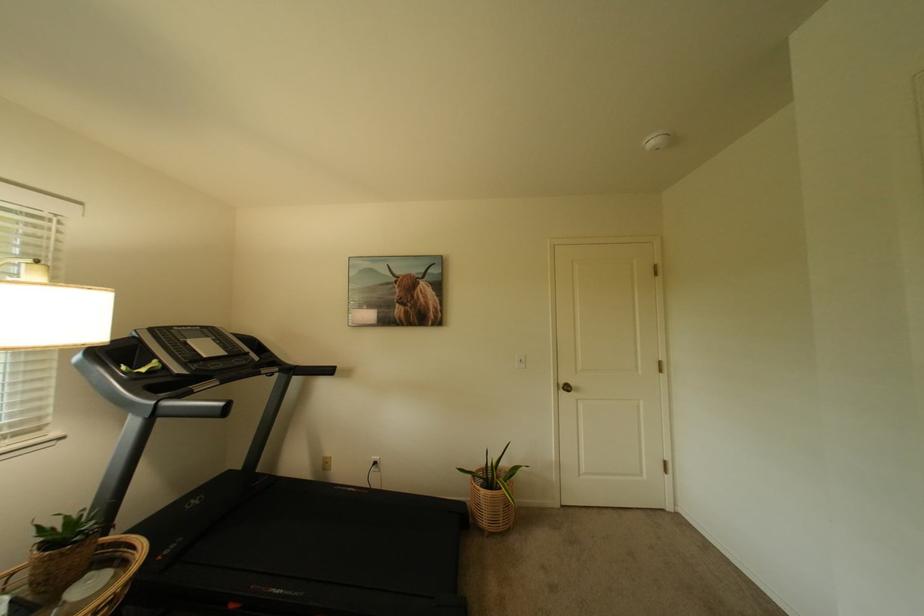
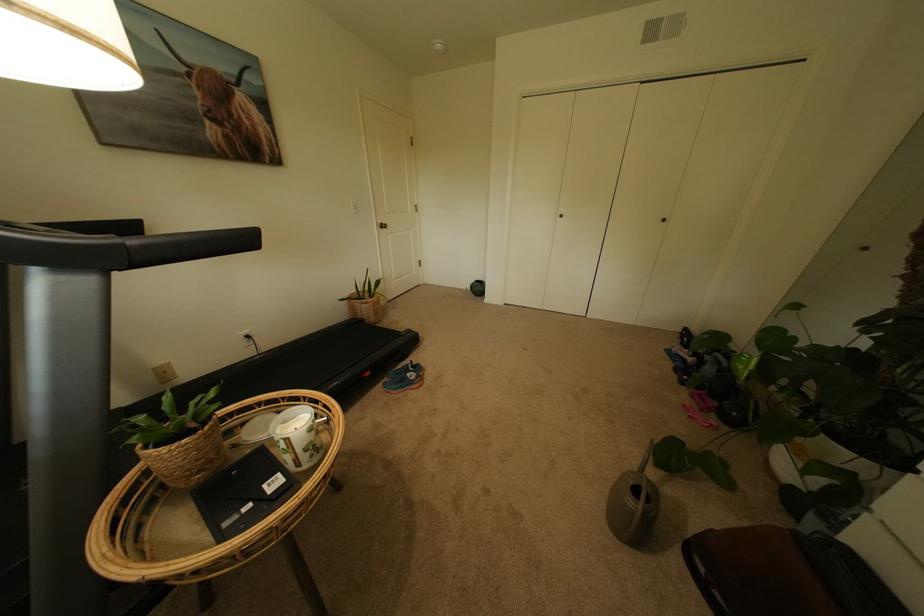
Where in the second image is the point corresponding to [404,294] from the first image?

(204, 100)